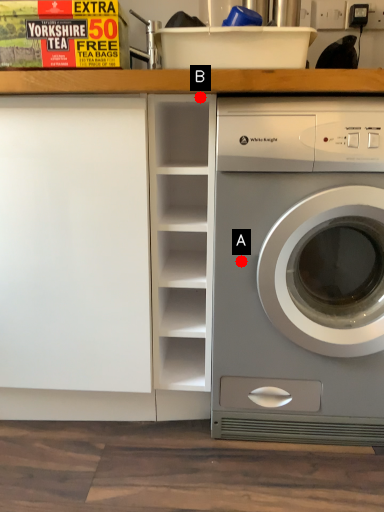
Question: Two points are circled on the image, labeled by A and B beside each circle. Which point is farther to the camera?

Choices:
 (A) A is further
 (B) B is further

Answer: (A)